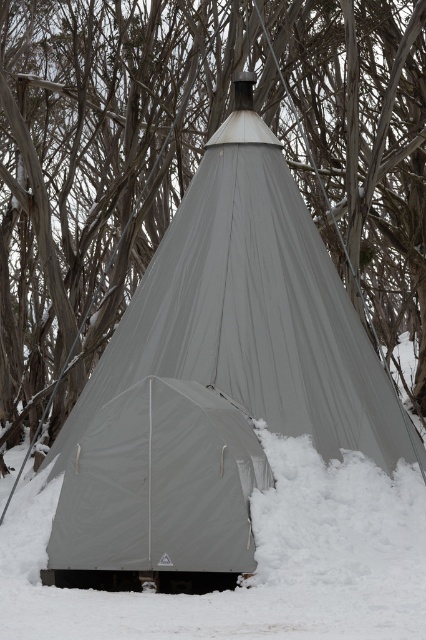
You are planning to set up a tent in a snowy area and have two options in front of you. You see a gray fabric tent at center and a matte gray tent at center. Which one is located to the right?

The gray fabric tent at center is positioned on the right side of matte gray tent at center, so the gray fabric tent at center is located to the right.

You are standing in front of the conical tent in the snowy environment. You see two points marked on the tent fabric. The first point is at coordinates point (32,76) and the second point is at point (189,416). Which point is closer to you?

Point (32,76) is further to the viewer than point (189,416), so the point closer to you is point (189,416).